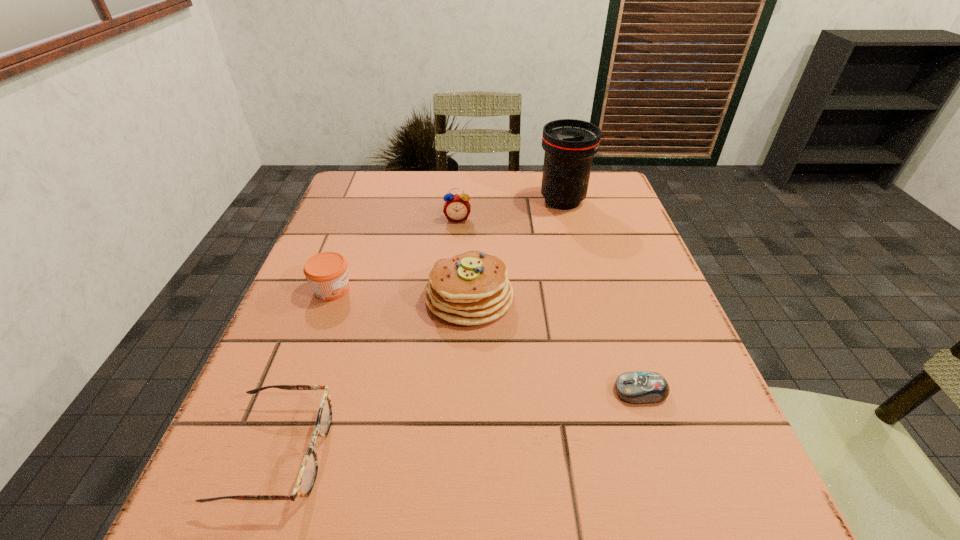
The image size is (960, 540). I want to click on telephoto lens, so click(569, 144).

Identify the location of alarm clock. (457, 208).

Where is `pancake`? The height and width of the screenshot is (540, 960). pancake is located at coordinates (472, 288).

The image size is (960, 540). In order to click on jam in this screenshot , I will do `click(327, 272)`.

Identify the location of spectacles. (308, 472).

Where is `computer mouse`? computer mouse is located at coordinates (643, 387).

The height and width of the screenshot is (540, 960). I want to click on free location located 0.330m on the front of the tallest object, so [590, 305].

Where is `free space located 0.060m on the front-facing side of the alarm clock`? free space located 0.060m on the front-facing side of the alarm clock is located at coordinates (456, 238).

Image resolution: width=960 pixels, height=540 pixels. Identify the location of vacant area located 0.310m on the front of the pancake. (464, 498).

Identify the location of vacant space situated 0.190m on the front label of the fourth tallest object. The width and height of the screenshot is (960, 540). (444, 289).